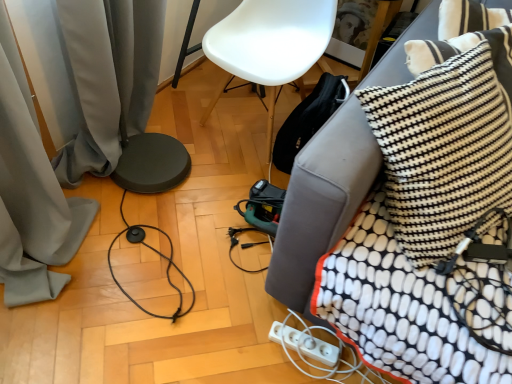
The width and height of the screenshot is (512, 384). Find the location of `vacant space to the right of gray fabric curtain at lower left`. vacant space to the right of gray fabric curtain at lower left is located at coordinates 227,192.